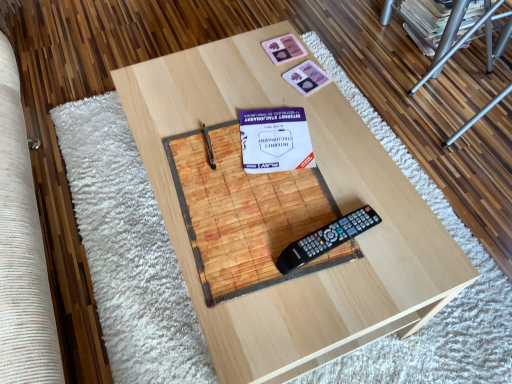
What are the coordinates of `vacant space that is to the left of pink matte coaster at upper center, arranged as the 1th square when viewed from the top` in the screenshot? It's located at click(x=230, y=64).